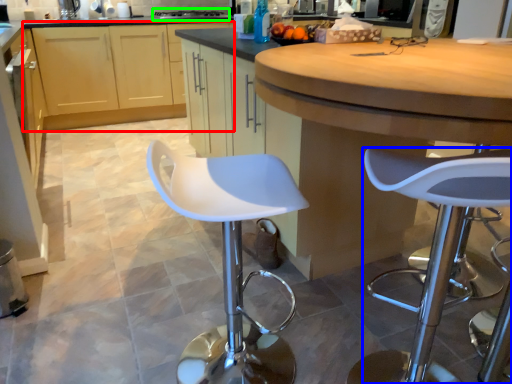
Question: Which is farther away from cabinetry (highlighted by a red box)? stool (highlighted by a blue box) or stove (highlighted by a green box)?

Choices:
 (A) stool
 (B) stove

Answer: (A)